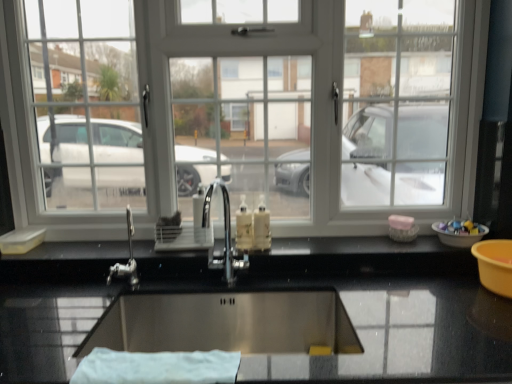
Question: Is white plastic bowl at right spatially inside polished chrome tap at center, or outside of it?

Choices:
 (A) outside
 (B) inside

Answer: (A)

Question: Relative to polished chrome tap at center, is white plastic bowl at right in front or behind?

Choices:
 (A) behind
 (B) front

Answer: (A)

Question: Which is nearer to the white plastic window at center?

Choices:
 (A) stainless steel sink at center
 (B) translucent plastic soap dispenser at center
 (C) polished chrome tap at center
 (D) stainless steel sink at center
 (E) white cloth at lower center

Answer: (D)

Question: Estimate the real-world distances between objects in this image. Which object is closer to the polished chrome tap at center?

Choices:
 (A) stainless steel sink at center
 (B) white cloth at lower center
 (C) white plastic bowl at right
 (D) stainless steel sink at center
 (E) translucent plastic soap dispenser at center

Answer: (E)